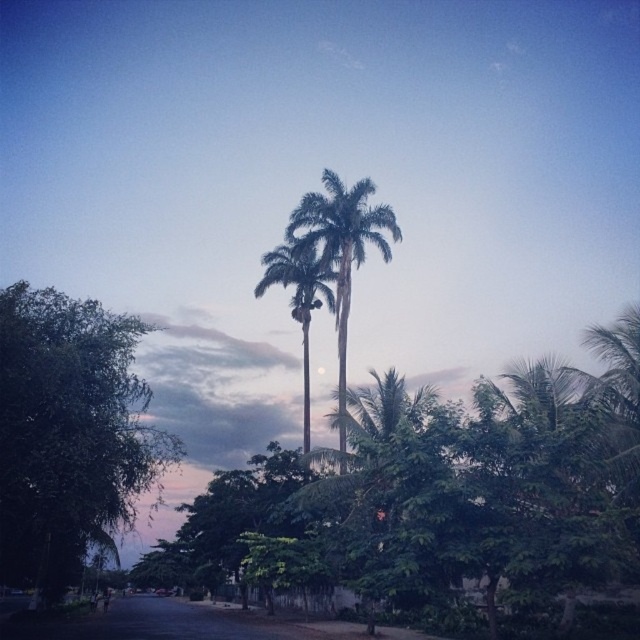
Between green leafy tree at left and green leafy palm trees at center, which one appears on the left side from the viewer's perspective?

green leafy tree at left is more to the left.

Is point (125, 458) less distant than point (340, 314)?

Yes, it is in front of point (340, 314).

Locate an element on the screen. The height and width of the screenshot is (640, 640). green leafy tree at left is located at coordinates (68, 433).

This screenshot has width=640, height=640. I want to click on green leafy tree at left, so click(x=68, y=433).

Which is more to the left, green leafy tree at left or green leafy palm tree at center?

green leafy tree at left is more to the left.

This screenshot has height=640, width=640. What are the coordinates of `green leafy tree at left` in the screenshot? It's located at pos(68,433).

Is point (40, 316) positioned before point (305, 449)?

Yes.

This screenshot has width=640, height=640. What are the coordinates of `green leafy tree at left` in the screenshot? It's located at (68, 433).

Looking at this image, who is more forward, (344,195) or (301,298)?

Point (344,195)

Measure the distance between green leafy palm trees at center and camera.

green leafy palm trees at center and camera are 32.04 meters apart from each other.

Where is `green leafy palm trees at center`? This screenshot has width=640, height=640. green leafy palm trees at center is located at coordinates (342, 253).